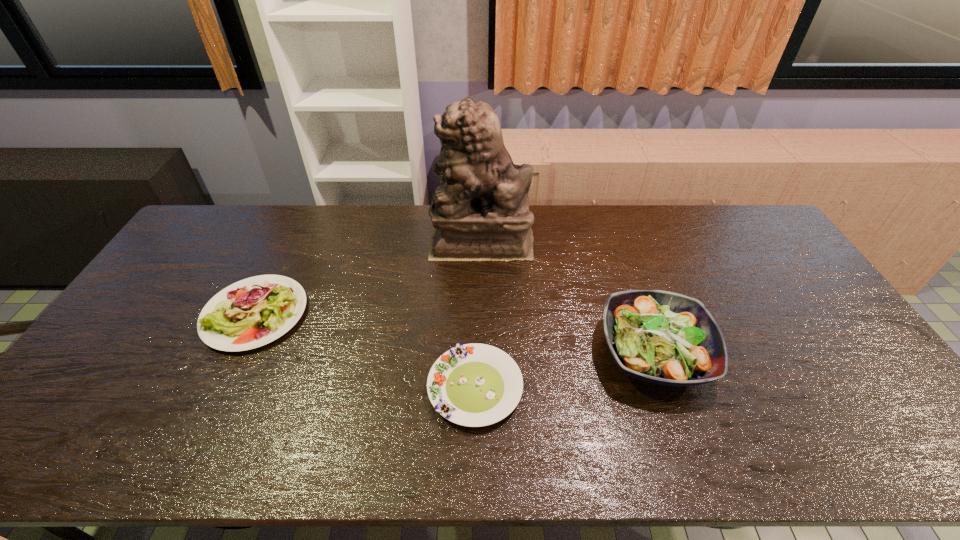
This screenshot has height=540, width=960. I want to click on vacant area that satisfies the following two spatial constraints: 1. on the back side of the tallest salad plate; 2. on the right side of the second salad plate from right to left, so click(475, 353).

Where is `blank area in the image that satisfies the following two spatial constraints: 1. on the front-facing side of the sculpture; 2. on the left side of the second tallest object`? blank area in the image that satisfies the following two spatial constraints: 1. on the front-facing side of the sculpture; 2. on the left side of the second tallest object is located at coordinates coord(481,353).